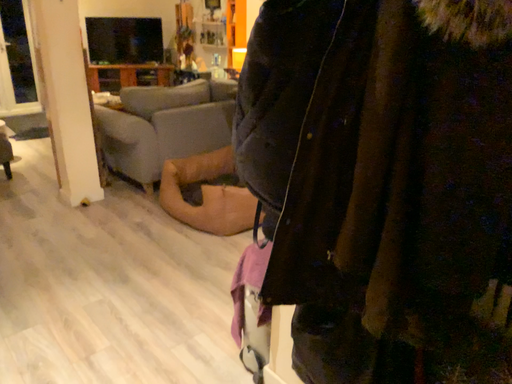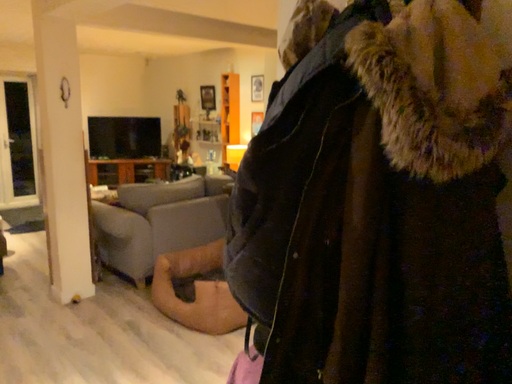
Question: How did the camera likely rotate when shooting the video?

Choices:
 (A) rotated downward
 (B) rotated upward

Answer: (B)